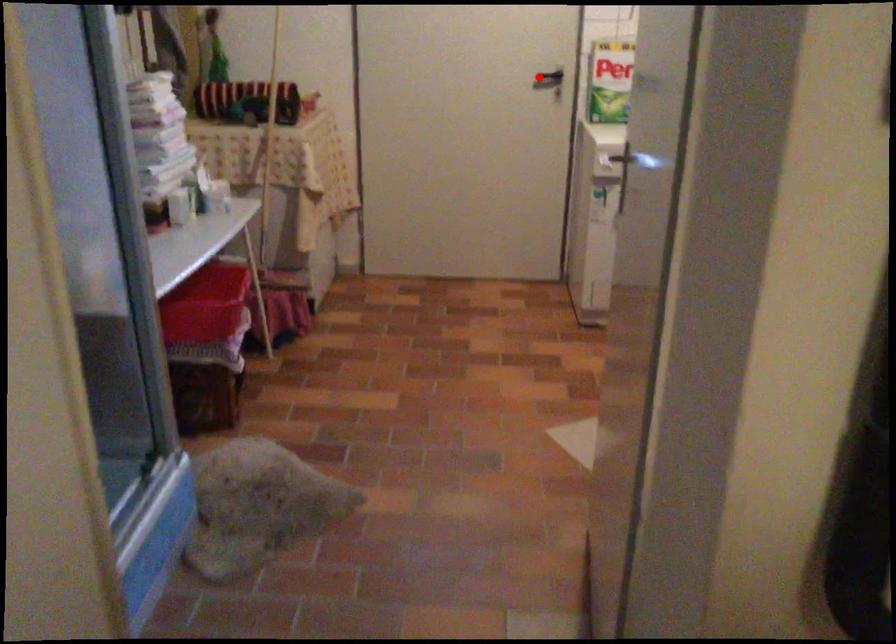
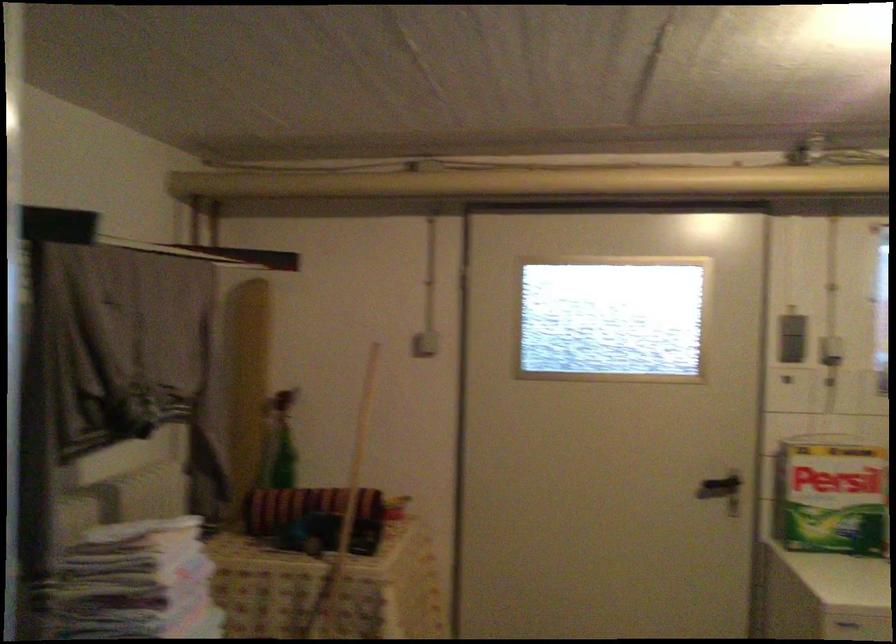
Question: I am providing you with two images of the same scene from different viewpoints. A red point is shown in image1. For the corresponding object point in image2, is it positioned nearer or farther from the camera?

Choices:
 (A) Nearer
 (B) Farther

Answer: (A)